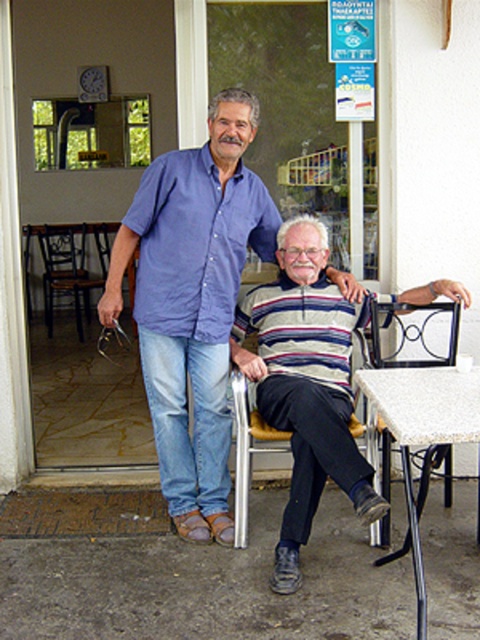
You are a photographer planning to take a portrait of both people in the scene. Since the blue cotton shirt at center and the striped knitwear at center are both at center, which one is closer to the camera?

The blue cotton shirt at center is closer to the camera because the striped knitwear at center is behind it.

You are standing at the point with coordinates point (408, 332). What object are you standing on?

You are standing on the metallic frame chair at lower right located at point (408, 332).